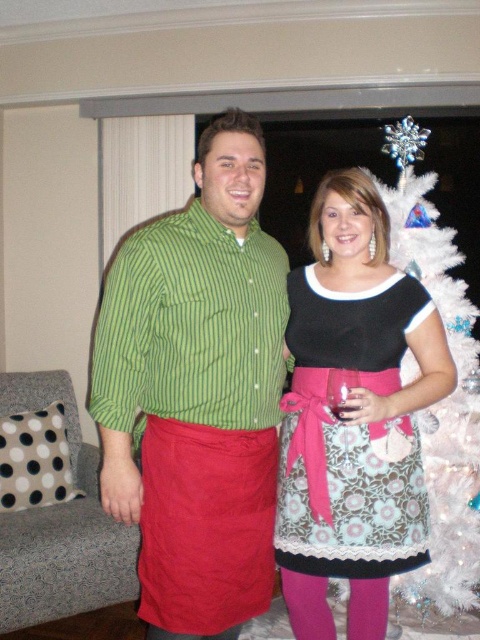
Does floral-patterned fabric dress at center lie in front of white fabric christmas tree at right?

Yes, it is.

Is floral-patterned fabric dress at center smaller than white fabric christmas tree at right?

Yes, floral-patterned fabric dress at center is smaller than white fabric christmas tree at right.

Locate an element on the screen. The width and height of the screenshot is (480, 640). floral-patterned fabric dress at center is located at coordinates (348, 435).

I want to click on floral-patterned fabric dress at center, so click(348, 435).

Who is taller, matte green striped shirt at center or floral-patterned fabric dress at center?

matte green striped shirt at center

Does matte green striped shirt at center appear over floral-patterned fabric dress at center?

Yes.

Which is in front, point (265, 424) or point (292, 504)?

Point (265, 424) is more forward.

Image resolution: width=480 pixels, height=640 pixels. Identify the location of matte green striped shirt at center. (196, 394).

Consider the image. Is matte green striped shirt at center wider than transparent glass at center?

Indeed, matte green striped shirt at center has a greater width compared to transparent glass at center.

Who is positioned more to the left, matte green striped shirt at center or transparent glass at center?

matte green striped shirt at center is more to the left.

What are the coordinates of `matte green striped shirt at center` in the screenshot? It's located at (196, 394).